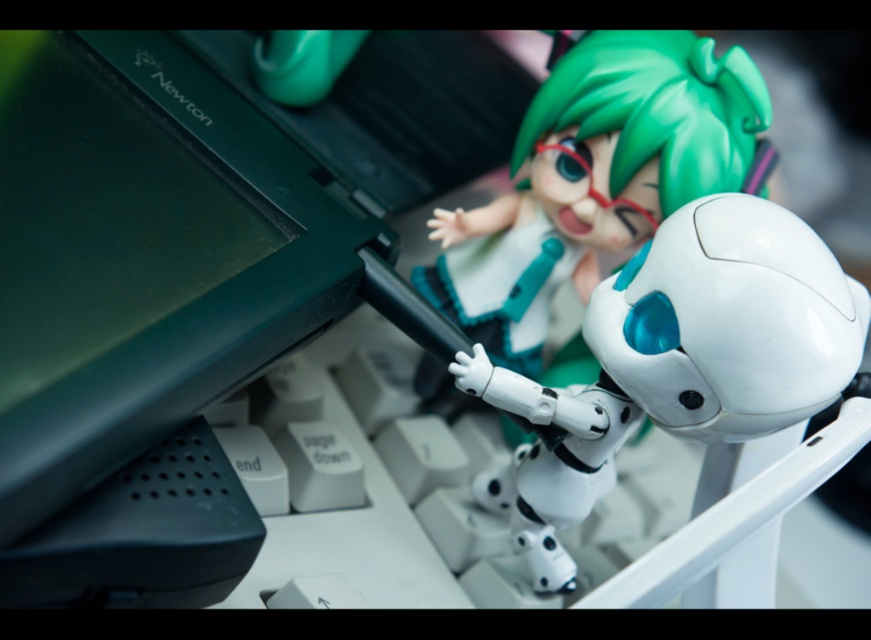
You are setting up a desk and want to place the black plastic computer at center and the white matte robot at center such that the taller object is on the left side. Which object should you place on the left?

The black plastic computer at center is taller than the white matte robot at center, so you should place the black plastic computer at center on the left side.